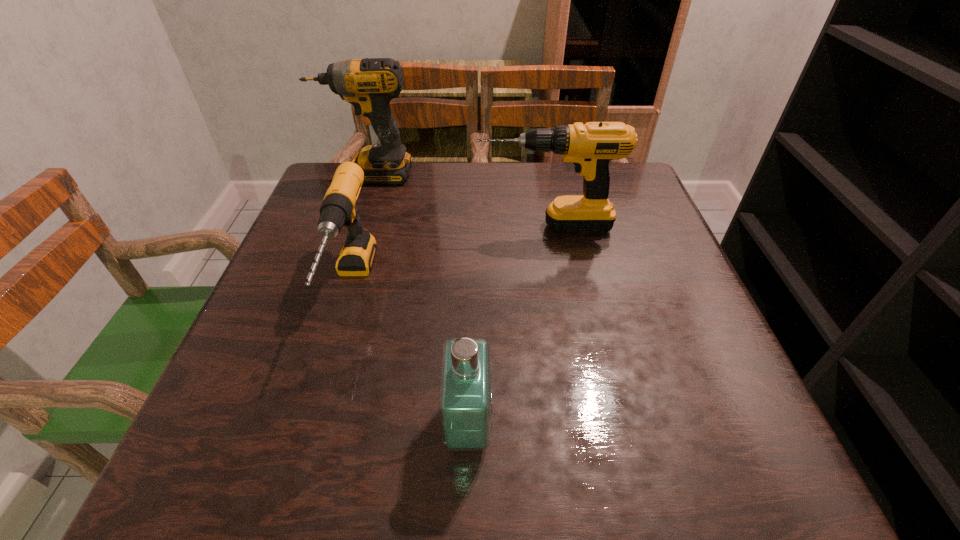
The width and height of the screenshot is (960, 540). I want to click on vacant region at the far right corner of the desktop, so click(x=617, y=193).

What are the coordinates of `free space between the farthest object and the perfume` in the screenshot? It's located at (419, 301).

You are a GUI agent. You are given a task and a screenshot of the screen. Output one action in this format:
    pyautogui.click(x=<x>, y=<y>)
    Task: Click on the vacant area between the rightmost drill and the perfume
    This screenshot has height=540, width=960.
    Given the screenshot: What is the action you would take?
    pyautogui.click(x=507, y=326)

In order to click on empty space between the second shortest drill and the farthest drill in this screenshot , I will do `click(457, 200)`.

Identify the location of free spot between the rightmost drill and the farthest object. The height and width of the screenshot is (540, 960). (457, 200).

You are a GUI agent. You are given a task and a screenshot of the screen. Output one action in this format:
    pyautogui.click(x=<x>, y=<y>)
    Task: Click on the vacant area that lies between the shortest drill and the nearest object
    This screenshot has height=540, width=960.
    Given the screenshot: What is the action you would take?
    pyautogui.click(x=410, y=355)

The height and width of the screenshot is (540, 960). In order to click on empty space between the second shortest drill and the shortest drill in this screenshot , I will do `click(448, 255)`.

Identify the location of empty space between the nearest object and the rightmost drill. (507, 326).

At what (x,y) coordinates should I click in order to perform the action: click on unoccupied position between the third shortest object and the tallest drill. Please return your answer as a coordinate pair (x, y). The height and width of the screenshot is (540, 960). Looking at the image, I should click on (457, 200).

You are a GUI agent. You are given a task and a screenshot of the screen. Output one action in this format:
    pyautogui.click(x=<x>, y=<y>)
    Task: Click on the free space that is in between the perfume and the second shortest drill
    The image size is (960, 540).
    Given the screenshot: What is the action you would take?
    pyautogui.click(x=507, y=326)